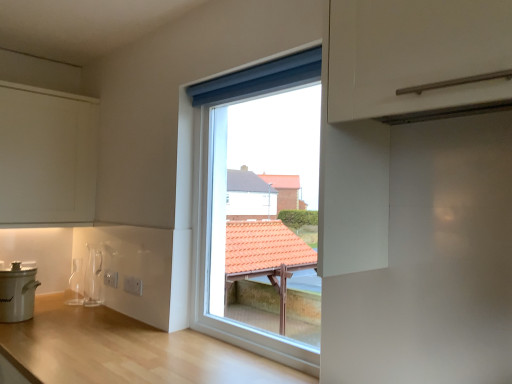
Question: Is white matte cooker at lower left taller or shorter than white matte cabinet at upper left?

Choices:
 (A) tall
 (B) short

Answer: (B)

Question: From a real-world perspective, is white matte cooker at lower left positioned above or below white matte cabinet at upper left?

Choices:
 (A) below
 (B) above

Answer: (A)

Question: Considering the real-world distances, which object is farthest from the white matte cabinet at upper left?

Choices:
 (A) white matte cooker at lower left
 (B) light wood countertop at center
 (C) white plastic window at center

Answer: (C)

Question: Which of these objects is positioned farthest from the light wood countertop at center?

Choices:
 (A) white matte cabinet at upper left
 (B) white matte cooker at lower left
 (C) white plastic window at center

Answer: (A)